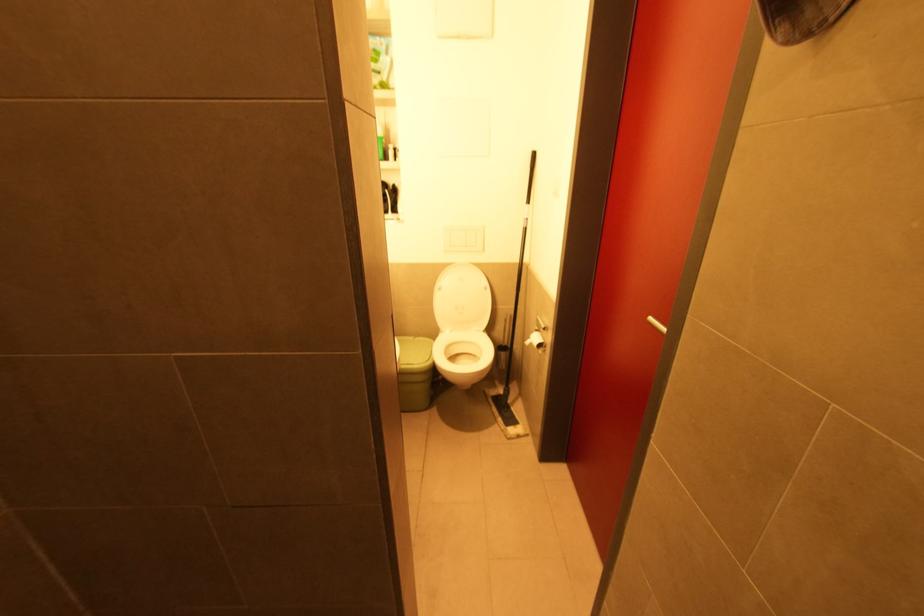
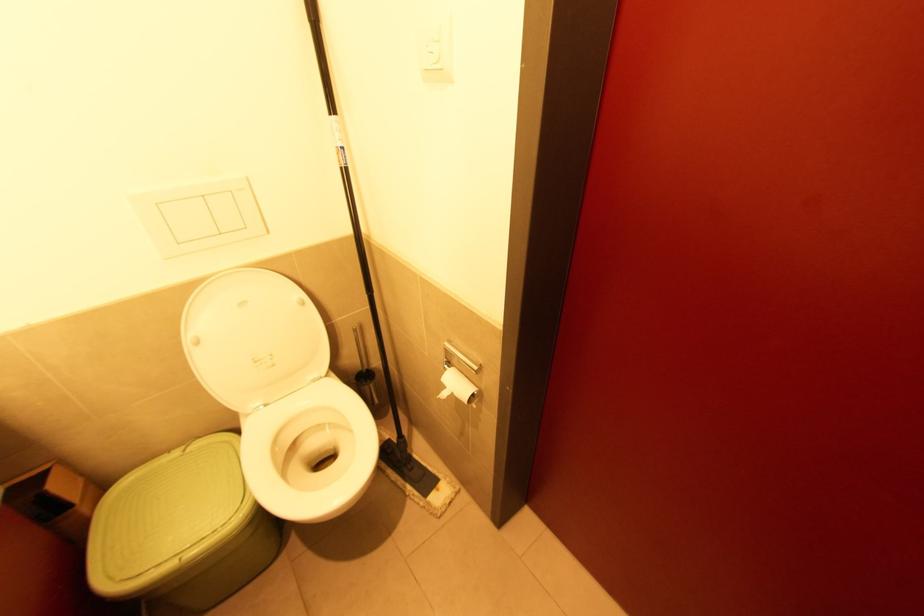
In the second image, find the point that corresponds to the point at 500,346 in the first image.

(358, 374)